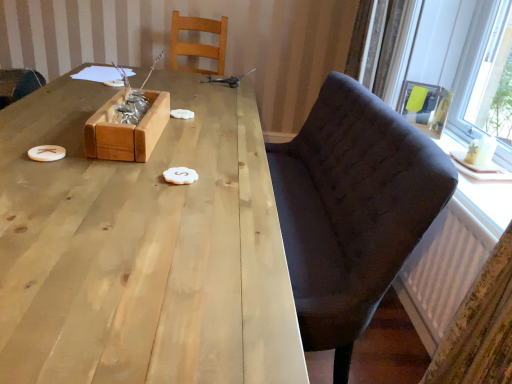
Identify the location of blank area to the left of white matte cookie at center, the second food in the left-to-right sequence. The height and width of the screenshot is (384, 512). (123, 179).